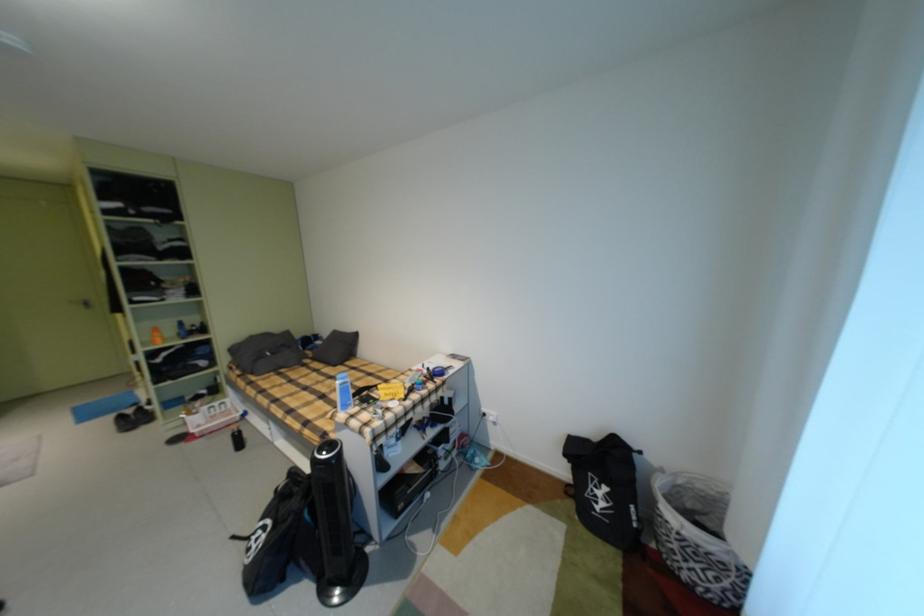
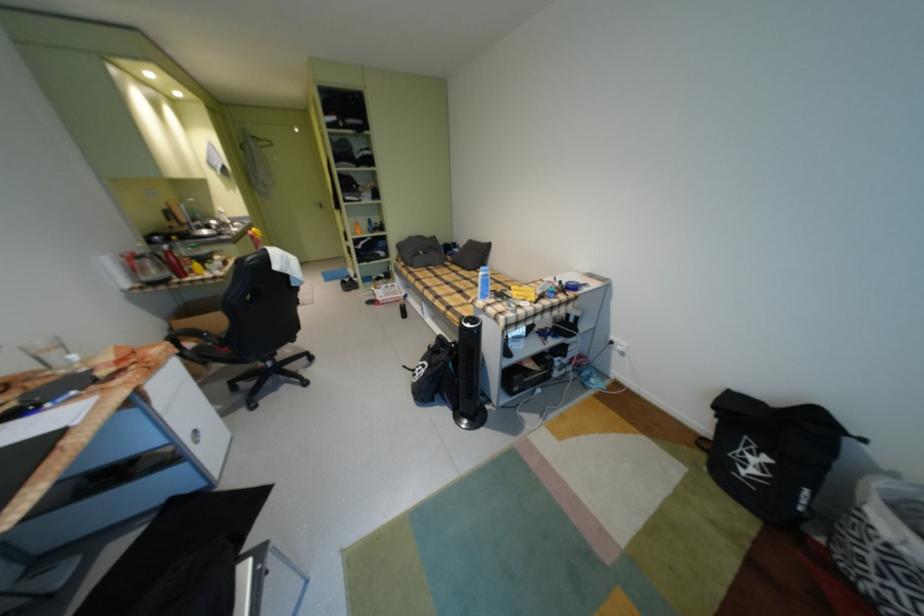
The point at (x=332, y=435) is marked in the first image. Where is the corresponding point in the second image?

(470, 318)